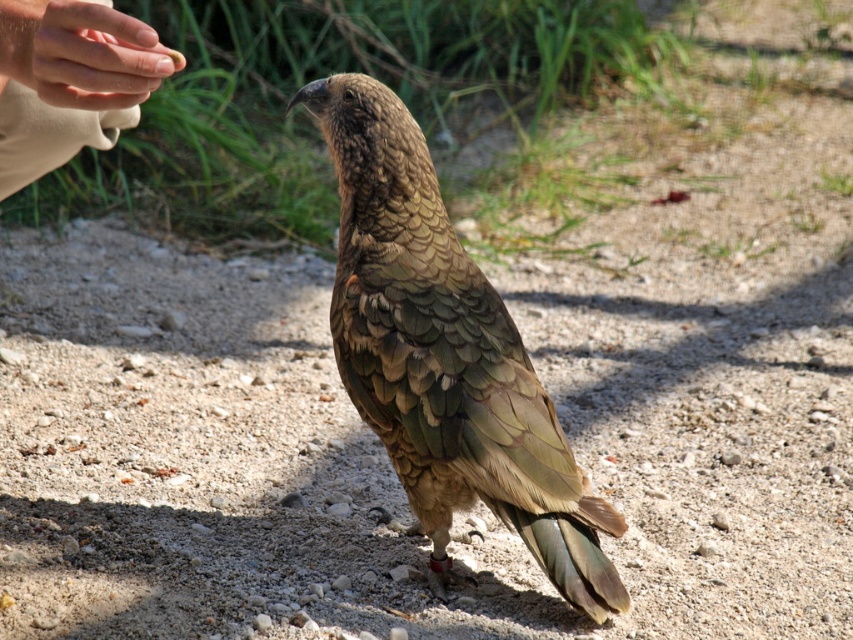
Does point (376, 100) come farther from viewer compared to point (73, 60)?

Yes, point (376, 100) is farther from viewer.

Which is more to the left, brown feathered bird at center or smooth skin hand at upper left?

smooth skin hand at upper left

Which is behind, point (595, 566) or point (78, 76)?

The point (595, 566) is more distant.

Locate an element on the screen. Image resolution: width=853 pixels, height=640 pixels. brown feathered bird at center is located at coordinates (445, 356).

Does brown feathered bird at center have a greater height compared to skinny tan hand at upper left?

Yes.

Does brown feathered bird at center have a greater width compared to skinny tan hand at upper left?

Correct, the width of brown feathered bird at center exceeds that of skinny tan hand at upper left.

Find the location of a particular element. Image resolution: width=853 pixels, height=640 pixels. brown feathered bird at center is located at coordinates (445, 356).

Which is more to the right, skinny tan hand at upper left or smooth skin hand at upper left?

smooth skin hand at upper left is more to the right.

Can you confirm if skinny tan hand at upper left is positioned to the right of smooth skin hand at upper left?

In fact, skinny tan hand at upper left is to the left of smooth skin hand at upper left.

Which is behind, point (83, 92) or point (10, 61)?

The point (10, 61) is more distant.

In order to click on skinny tan hand at upper left in this screenshot , I will do `click(68, 81)`.